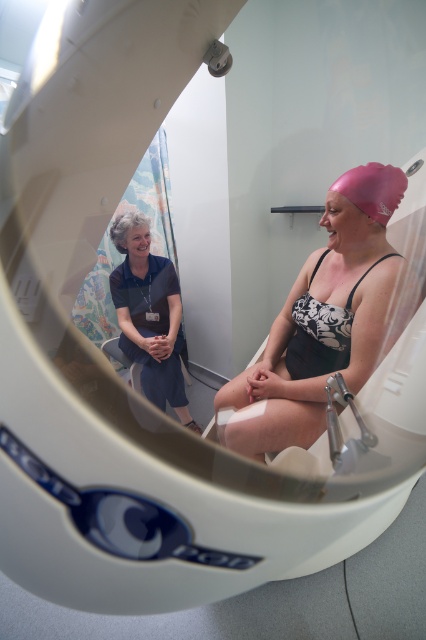
Does pink matte swim cap at upper right appear on the left side of black printed bikini top at center?

Yes, pink matte swim cap at upper right is to the left of black printed bikini top at center.

Locate an element on the screen. This screenshot has width=426, height=640. pink matte swim cap at upper right is located at coordinates (324, 321).

Who is more forward, (236, 436) or (353, 291)?

Point (353, 291)

You are a GUI agent. You are given a task and a screenshot of the screen. Output one action in this format:
    pyautogui.click(x=<x>, y=<y>)
    Task: Click on the pink matte swim cap at upper right
    
    Given the screenshot: What is the action you would take?
    pyautogui.click(x=324, y=321)

Can you confirm if pink matte swim cap at upper right is positioned above blue fabric dress at upper left?

Yes.

Can you confirm if pink matte swim cap at upper right is positioned below blue fabric dress at upper left?

No.

Is point (255, 392) positioned behind point (131, 218)?

No, it is not.

This screenshot has width=426, height=640. What are the coordinates of `pink matte swim cap at upper right` in the screenshot? It's located at (324, 321).

Who is higher up, blue fabric dress at upper left or black printed bikini top at center?

Positioned higher is black printed bikini top at center.

Between blue fabric dress at upper left and black printed bikini top at center, which one appears on the left side from the viewer's perspective?

From the viewer's perspective, blue fabric dress at upper left appears more on the left side.

Does point (144, 358) come closer to viewer compared to point (324, 256)?

No, (144, 358) is further to viewer.

This screenshot has width=426, height=640. What are the coordinates of `blue fabric dress at upper left` in the screenshot? It's located at (149, 314).